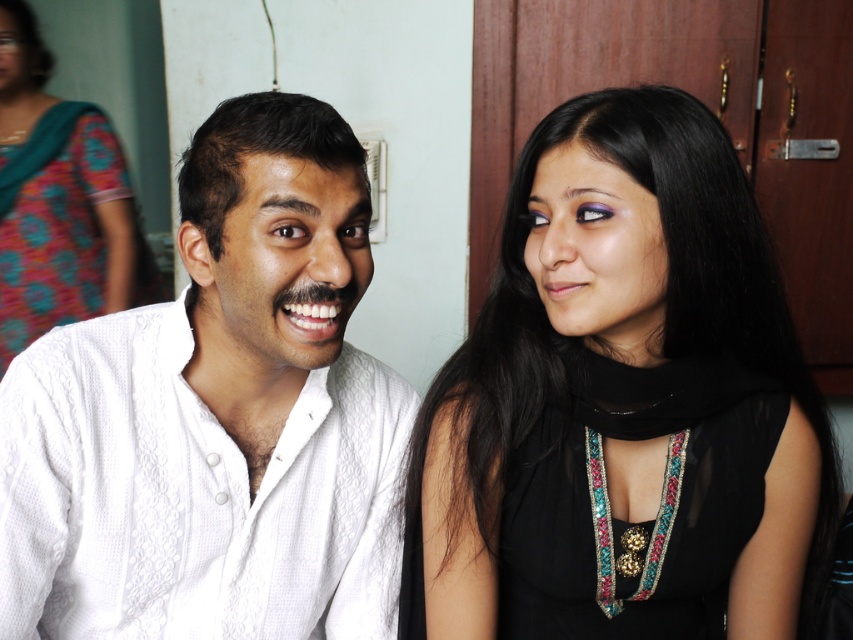
Question: Is white textured shirt at left wider than teal floral sari at upper left?

Choices:
 (A) yes
 (B) no

Answer: (A)

Question: Is black satin dress at center bigger than teal floral sari at upper left?

Choices:
 (A) yes
 (B) no

Answer: (B)

Question: Estimate the real-world distances between objects in this image. Which object is closer to the white textured shirt at left?

Choices:
 (A) black satin dress at center
 (B) teal floral sari at upper left

Answer: (A)

Question: Among these points, which one is farthest from the camera?

Choices:
 (A) (115, 353)
 (B) (73, 179)

Answer: (B)

Question: Which of these objects is positioned farthest from the white textured shirt at left?

Choices:
 (A) teal floral sari at upper left
 (B) black satin dress at center

Answer: (A)

Question: Observing the image, what is the correct spatial positioning of black satin dress at center in reference to white textured shirt at left?

Choices:
 (A) above
 (B) below

Answer: (B)